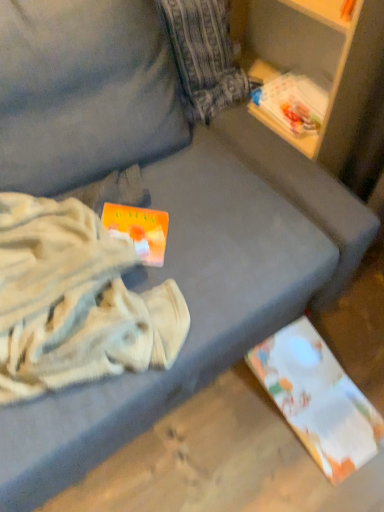
Find the location of a particular element. The image size is (384, 512). empty space that is ontop of orange matte paperback book at center-left, arranged as the 2th paperback book when ordered from the bottom (from a real-world perspective) is located at coordinates (112, 226).